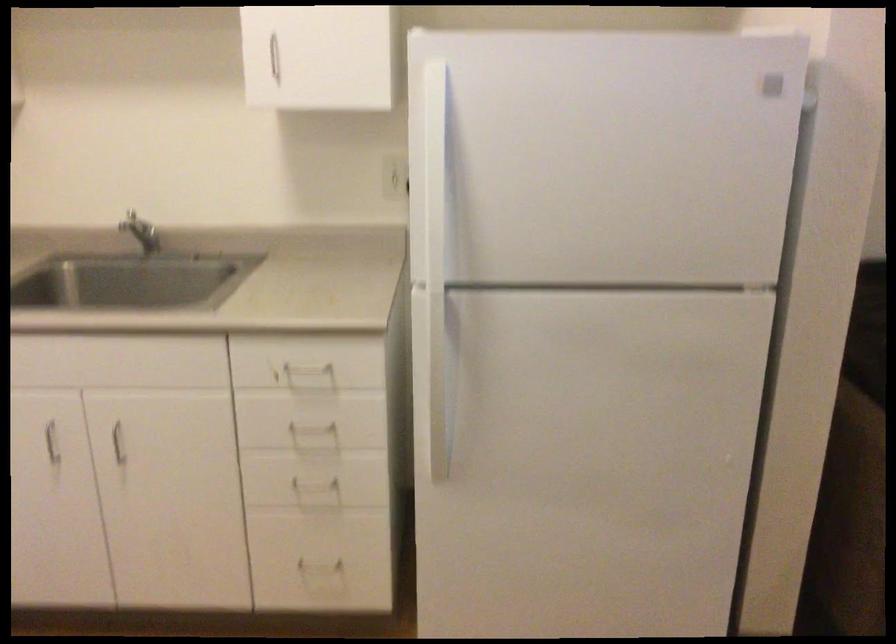
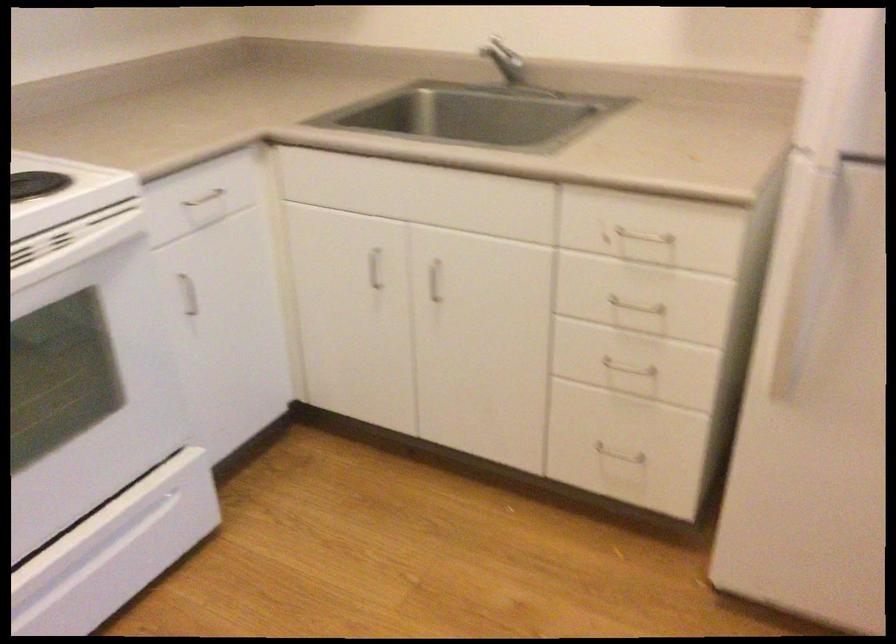
In the second image, find the point that corresponds to (x=314, y=433) in the first image.

(634, 313)